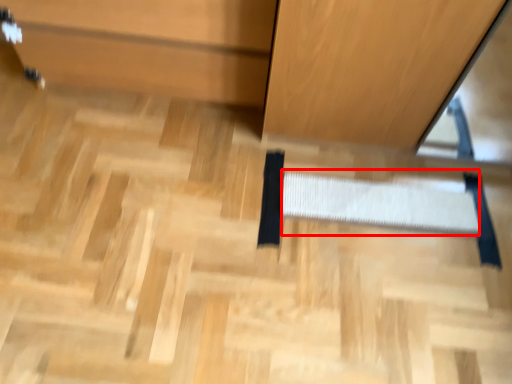
Question: From the image's perspective, where is stair (annotated by the red box) located relative to cabinetry?

Choices:
 (A) below
 (B) above

Answer: (A)